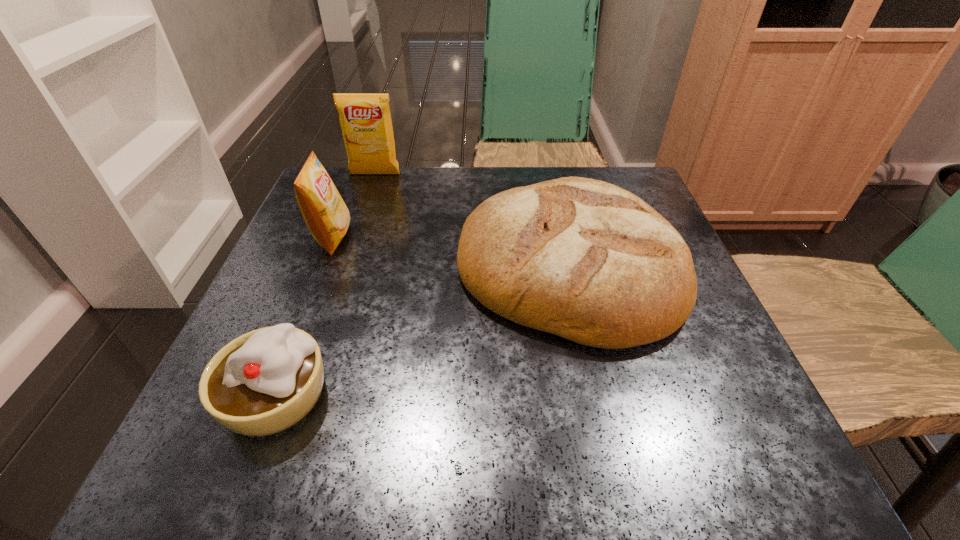
Find the location of a particular element. This screenshot has width=960, height=540. bread present at the far edge is located at coordinates (586, 260).

Identify the location of object present at the near edge. (263, 382).

Where is `whipped cream that is positioned at the left edge`? The height and width of the screenshot is (540, 960). whipped cream that is positioned at the left edge is located at coordinates (263, 382).

This screenshot has height=540, width=960. What are the coordinates of `object located in the right edge section of the desktop` in the screenshot? It's located at (586, 260).

Where is `object that is at the near left corner`? The image size is (960, 540). object that is at the near left corner is located at coordinates pyautogui.click(x=263, y=382).

Locate an element on the screen. Image resolution: width=960 pixels, height=540 pixels. object that is at the far right corner is located at coordinates (586, 260).

You are a GUI agent. You are given a task and a screenshot of the screen. Output one action in this format:
    pyautogui.click(x=<x>, y=<y>)
    Task: Click on the free space at the far edge of the desktop
    This screenshot has width=960, height=540.
    Given the screenshot: What is the action you would take?
    pyautogui.click(x=546, y=179)

Find the location of a particular element. vacant space at the near edge of the desktop is located at coordinates 557,468.

Identify the location of free space at the left edge. The image size is (960, 540). (285, 280).

At what (x,y) coordinates should I click in order to perform the action: click on free space at the right edge. Please return your answer as a coordinate pair (x, y). The width and height of the screenshot is (960, 540). Looking at the image, I should click on (677, 363).